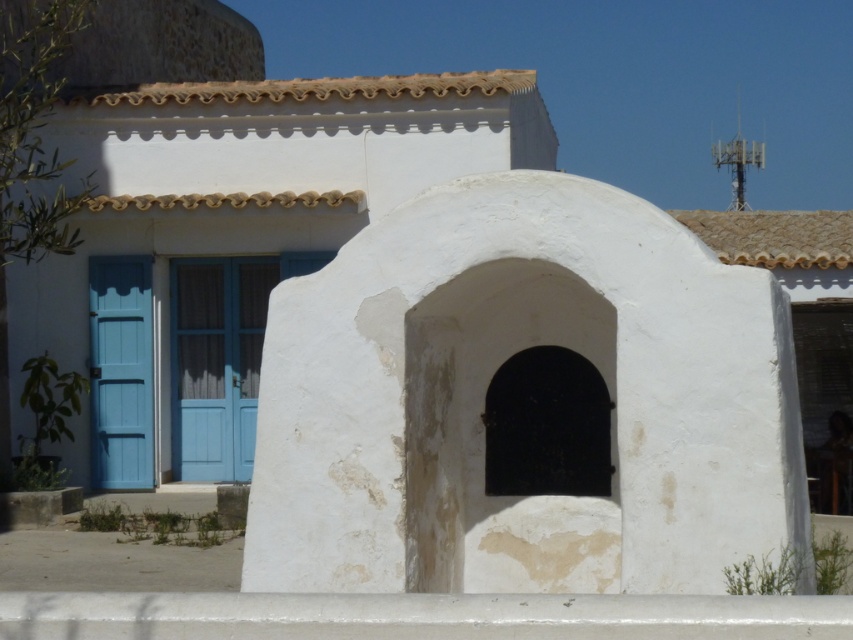
Is matte blue door at center smaller than blue painted wood door at left?

Actually, matte blue door at center might be larger than blue painted wood door at left.

Which is more to the right, matte blue door at center or blue painted wood door at left?

matte blue door at center

Between point (219, 436) and point (146, 333), which one is positioned in front?

Point (146, 333) is more forward.

Where is `matte blue door at center`? matte blue door at center is located at coordinates (218, 362).

Which is more to the left, white rough stone archway at center or blue painted wood door at left?

blue painted wood door at left

Is point (618, 422) farther from viewer compared to point (114, 413)?

No, it is not.

Where is `white rough stone archway at center`? The width and height of the screenshot is (853, 640). white rough stone archway at center is located at coordinates (486, 387).

Does white rough stone archway at center have a lesser width compared to matte blue door at center?

No.

Is point (273, 340) positioned behind point (216, 312)?

No, (273, 340) is closer to viewer.

Where is `white rough stone archway at center`? The image size is (853, 640). white rough stone archway at center is located at coordinates (486, 387).

At what (x,y) coordinates should I click in order to perform the action: click on white rough stone archway at center. Please return your answer as a coordinate pair (x, y). Image resolution: width=853 pixels, height=640 pixels. Looking at the image, I should click on (486, 387).